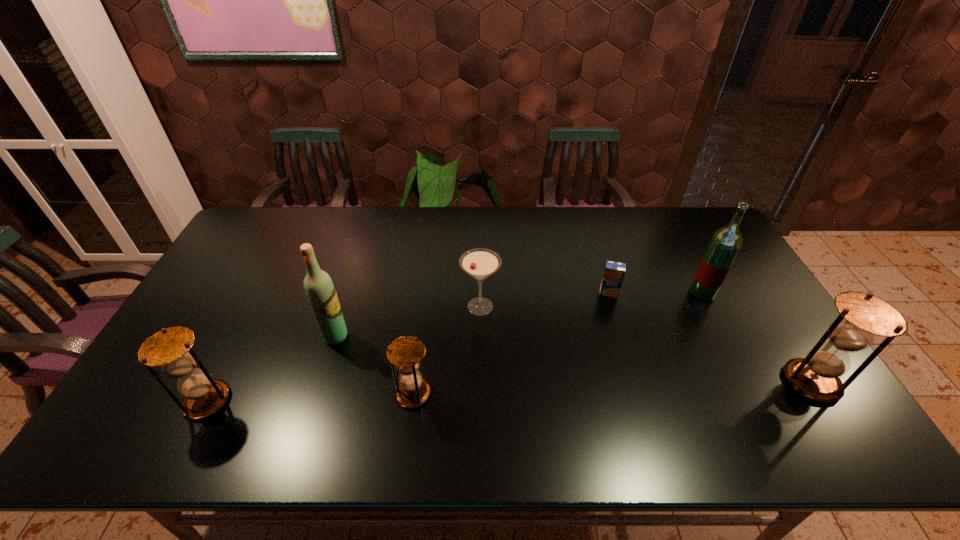
Please mark a free spot for a new hourglass to balance the arrangement. Please provide its 2D coordinates. Your answer should be formatted as a tuple, i.e. [(x, y)], where the tuple contains the x and y coordinates of a point satisfying the conditions above.

[(614, 388)]